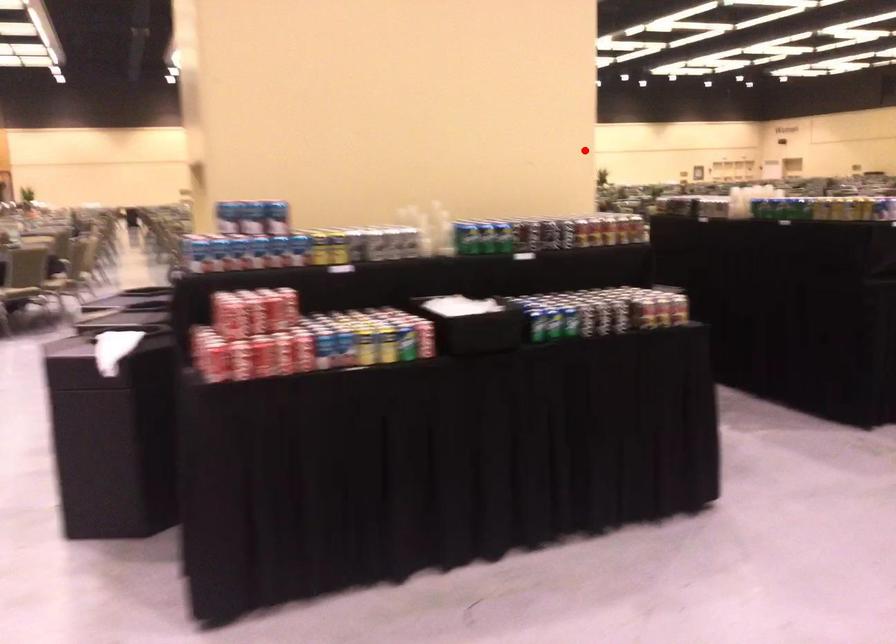
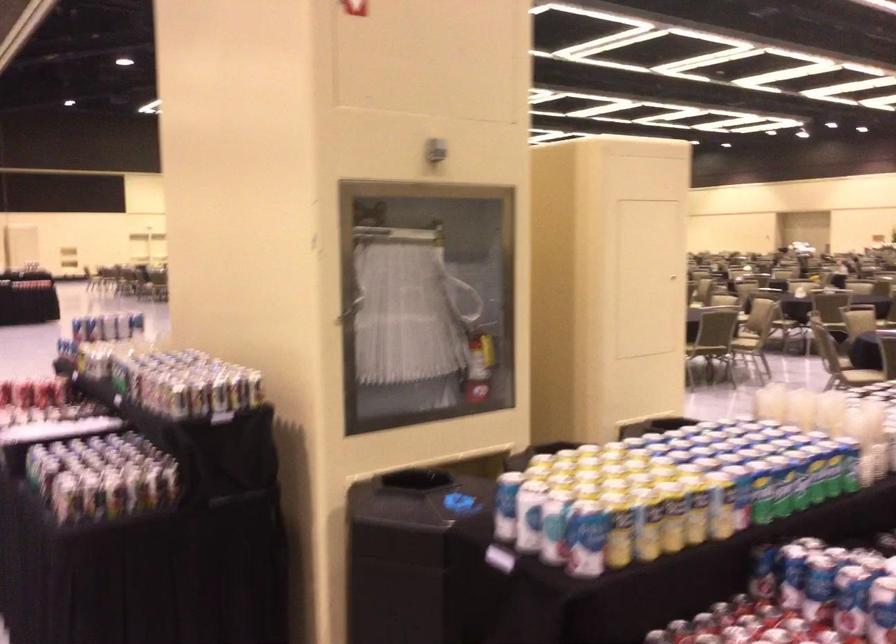
Question: A red point is marked in image1. In image2, is the corresponding 3D point closer to the camera or farther? Reply with the corresponding letter.

Choices:
 (A) The corresponding 3D point is closer.
 (B) The corresponding 3D point is farther.

Answer: (A)